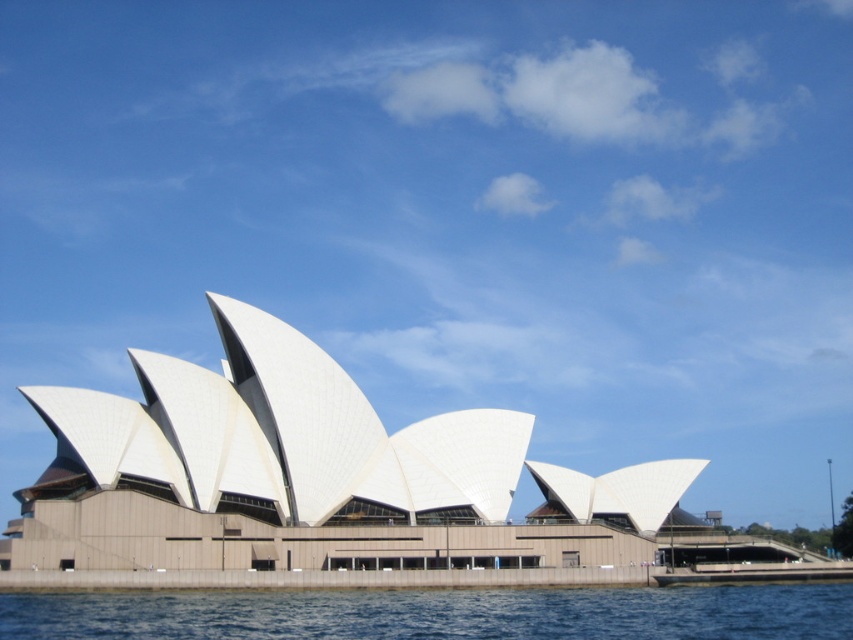
Question: Which point appears closest to the camera in this image?

Choices:
 (A) (387, 444)
 (B) (456, 595)

Answer: (B)

Question: Is white fabric opera house at center above blue water at lower center?

Choices:
 (A) no
 (B) yes

Answer: (B)

Question: Which point is farther from the camera taking this photo?

Choices:
 (A) (125, 429)
 (B) (755, 605)

Answer: (A)

Question: Is white fabric opera house at center bigger than blue water at lower center?

Choices:
 (A) no
 (B) yes

Answer: (B)

Question: Which point is closer to the camera taking this photo?

Choices:
 (A) (155, 600)
 (B) (242, 378)

Answer: (A)

Question: Does white fabric opera house at center have a smaller size compared to blue water at lower center?

Choices:
 (A) no
 (B) yes

Answer: (A)